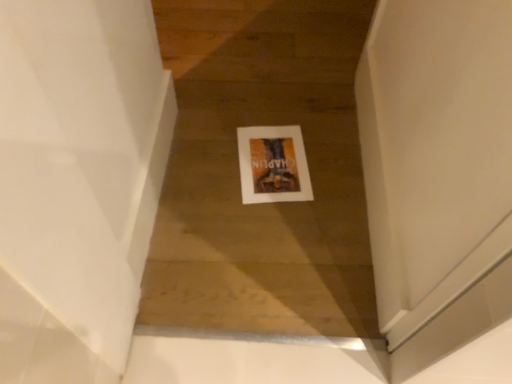
Where is `free space above white matte picture frame at center (from a real-world perspective)`? This screenshot has width=512, height=384. free space above white matte picture frame at center (from a real-world perspective) is located at coordinates (269, 159).